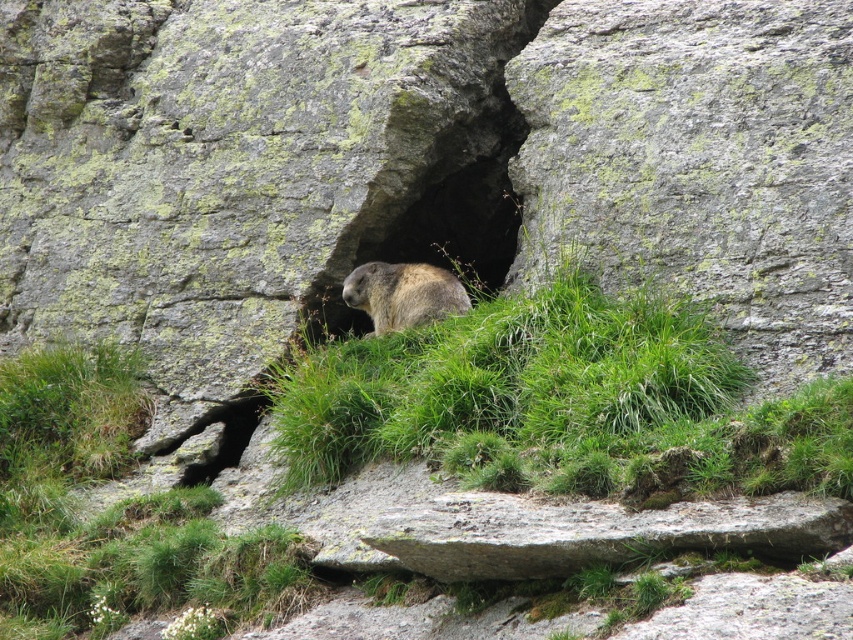
Does green grassy at center appear on the right side of brown fur at center?

No, green grassy at center is not to the right of brown fur at center.

The width and height of the screenshot is (853, 640). What do you see at coordinates (114, 513) in the screenshot? I see `green grassy at center` at bounding box center [114, 513].

The width and height of the screenshot is (853, 640). I want to click on green grassy at center, so click(x=114, y=513).

Can you confirm if brown fur at center is thinner than fuzzy brown bear at center?

Incorrect, brown fur at center's width is not less than fuzzy brown bear at center's.

At what (x,y) coordinates should I click in order to perform the action: click on brown fur at center. Please return your answer as a coordinate pair (x, y). Looking at the image, I should click on (430, 205).

Does green grassy at center appear under fuzzy brown bear at center?

Indeed, green grassy at center is positioned under fuzzy brown bear at center.

Between point (77, 452) and point (460, 308), which one is positioned behind?

Positioned behind is point (460, 308).

This screenshot has width=853, height=640. Identify the location of green grassy at center. (114, 513).